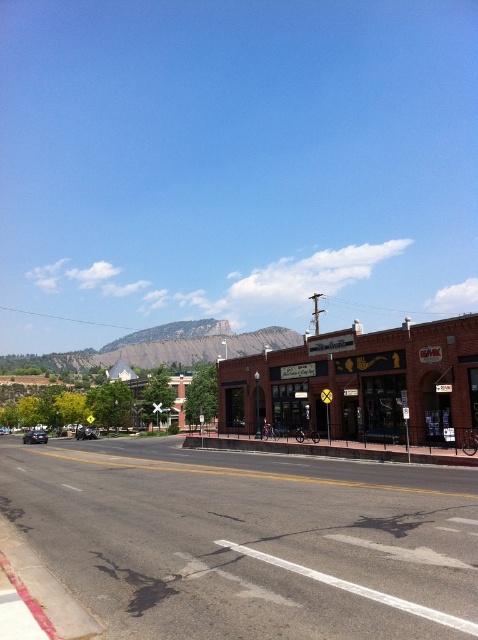
Does brick building at center have a larger size compared to shiny black sedan at left?

Yes, brick building at center is bigger than shiny black sedan at left.

Measure the distance between brick building at center and camera.

brick building at center is 22.75 meters from camera.

The image size is (478, 640). I want to click on brick building at center, so click(359, 385).

In order to click on brick building at center in this screenshot , I will do `click(359, 385)`.

Between brick building at center and brown brick building at center, which one appears on the left side from the viewer's perspective?

brown brick building at center is more to the left.

Between point (294, 378) and point (143, 388), which one is positioned in front?

Positioned in front is point (294, 378).

Where is `brick building at center`? This screenshot has width=478, height=640. brick building at center is located at coordinates (359, 385).

Does shiny black sedan at center appear on the left side of shiny black sedan at left?

Yes, shiny black sedan at center is to the left of shiny black sedan at left.

Is shiny black sedan at center taller than shiny black sedan at left?

Yes.

What do you see at coordinates (34, 436) in the screenshot? I see `shiny black sedan at center` at bounding box center [34, 436].

I want to click on shiny black sedan at center, so click(x=34, y=436).